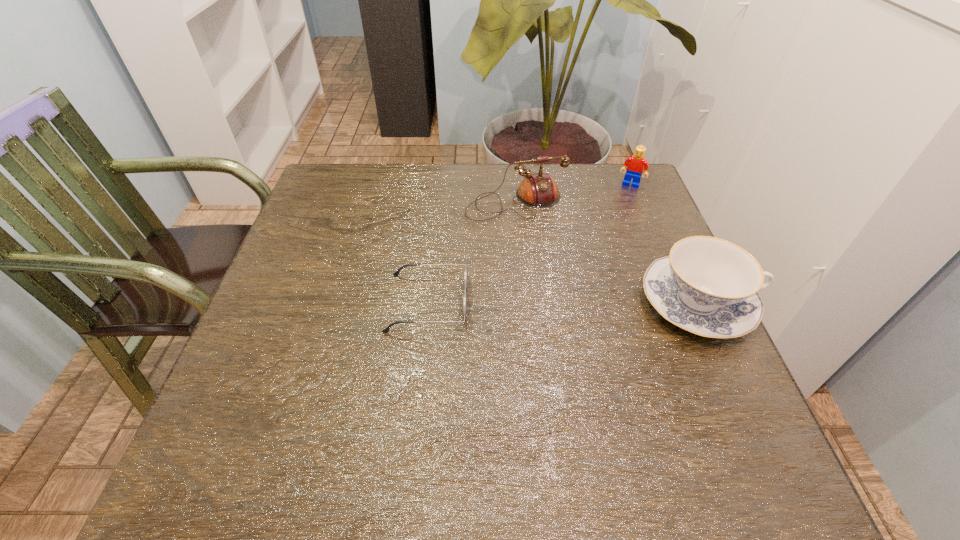
Where is `vacant space at the far left corner of the desktop`? This screenshot has width=960, height=540. vacant space at the far left corner of the desktop is located at coordinates (337, 164).

Where is `vacant space at the far right corner`? The image size is (960, 540). vacant space at the far right corner is located at coordinates [647, 207].

You are a GUI agent. You are given a task and a screenshot of the screen. Output one action in this format:
    pyautogui.click(x=<x>, y=<y>)
    Task: Click on the vacant area between the Lego and the chinaware
    The width and height of the screenshot is (960, 540).
    Given the screenshot: What is the action you would take?
    pyautogui.click(x=664, y=244)

Identify the location of empty space between the telephone and the Lego. (573, 193).

At what (x,y) coordinates should I click in order to perform the action: click on free area in between the shortest object and the chinaware. Please return your answer as a coordinate pair (x, y). Image resolution: width=960 pixels, height=540 pixels. Looking at the image, I should click on (563, 303).

Locate an element on the screen. vacant region between the chinaware and the Lego is located at coordinates (664, 244).

This screenshot has width=960, height=540. I want to click on free space that is in between the sunglasses and the Lego, so click(529, 244).

The image size is (960, 540). What are the coordinates of `free space between the telephone and the sunglasses` in the screenshot? It's located at (472, 252).

At what (x,y) coordinates should I click in order to perform the action: click on free space between the telephone and the Lego. Please return your answer as a coordinate pair (x, y). This screenshot has height=540, width=960. Looking at the image, I should click on (573, 193).

Find the location of `empty space between the telephone and the sunglasses`. empty space between the telephone and the sunglasses is located at coordinates (472, 252).